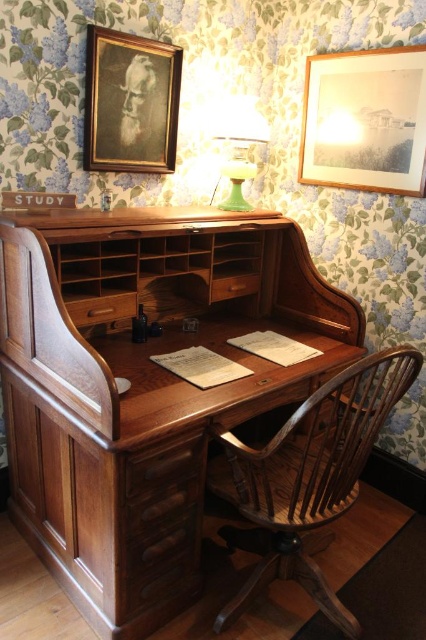
You are a person who needs to reach for a book on a high shelf. You have the green glass lamp at upper center and the wooden drawer at center in your view. Which object should you move to get a better view of the high shelf?

The green glass lamp at upper center is much taller than the wooden drawer at center, so moving it would block your view more. Therefore, you should move the wooden drawer at center to get a better view of the high shelf.